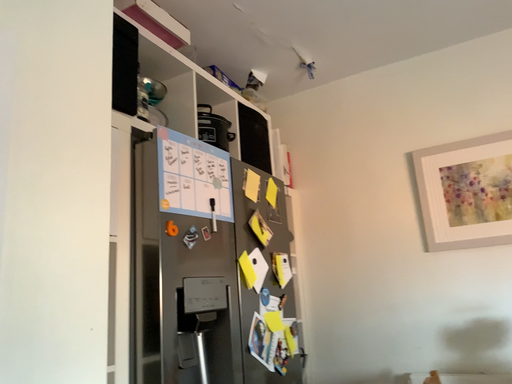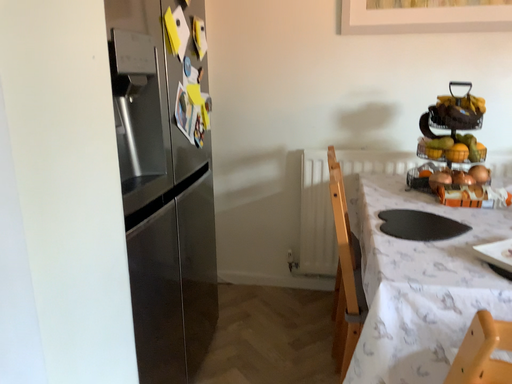
Question: How did the camera likely rotate when shooting the video?

Choices:
 (A) rotated upward
 (B) rotated downward

Answer: (B)